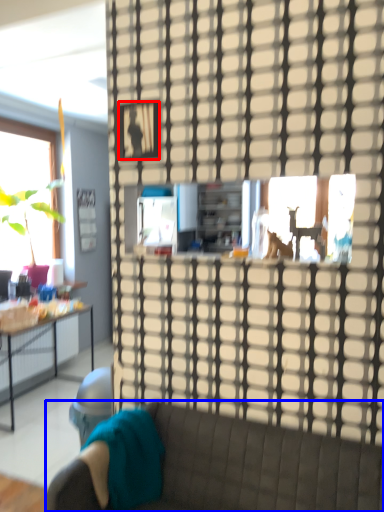
Question: Which object is further to the camera taking this photo, picture frame (highlighted by a red box) or studio couch (highlighted by a blue box)?

Choices:
 (A) picture frame
 (B) studio couch

Answer: (A)